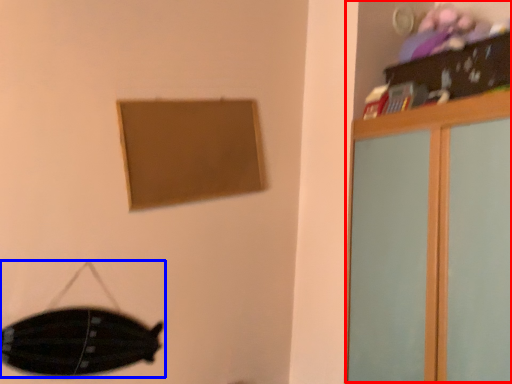
Question: Which object is further to the camera taking this photo, dresser (highlighted by a red box) or swivel chair (highlighted by a blue box)?

Choices:
 (A) dresser
 (B) swivel chair

Answer: (B)